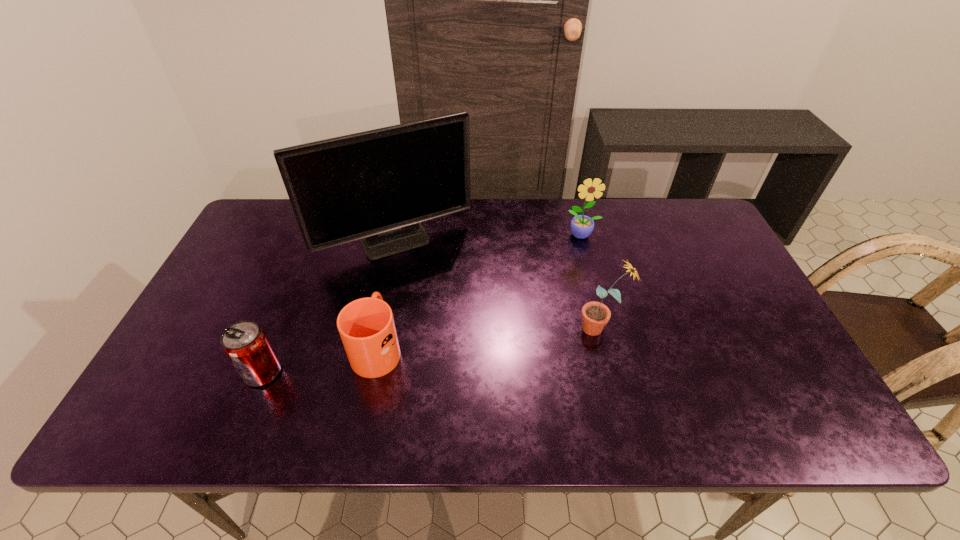
I want to click on free location located on the handle side of the mug, so click(386, 306).

Where is `free space located 0.160m on the handle side of the mug`? Image resolution: width=960 pixels, height=540 pixels. free space located 0.160m on the handle side of the mug is located at coordinates (392, 276).

Locate an element on the screen. Image resolution: width=960 pixels, height=540 pixels. blank space located on the handle side of the mug is located at coordinates (393, 272).

This screenshot has height=540, width=960. Find the location of `vacant region located 0.340m on the right of the pop soda`. vacant region located 0.340m on the right of the pop soda is located at coordinates (427, 373).

The image size is (960, 540). What are the coordinates of `computer monitor positioned at the far edge` in the screenshot? It's located at (377, 186).

Find the location of a particular element. This screenshot has width=960, height=540. sunflower that is positioned at the far edge is located at coordinates (581, 226).

In the image, there is a desktop. Where is `vacant region at the far edge`? vacant region at the far edge is located at coordinates (506, 206).

Identify the location of free space at the near edge. The width and height of the screenshot is (960, 540). (366, 422).

Identify the location of free space at the left edge. (193, 366).

Where is `free space at the right edge of the desktop`? free space at the right edge of the desktop is located at coordinates (715, 346).